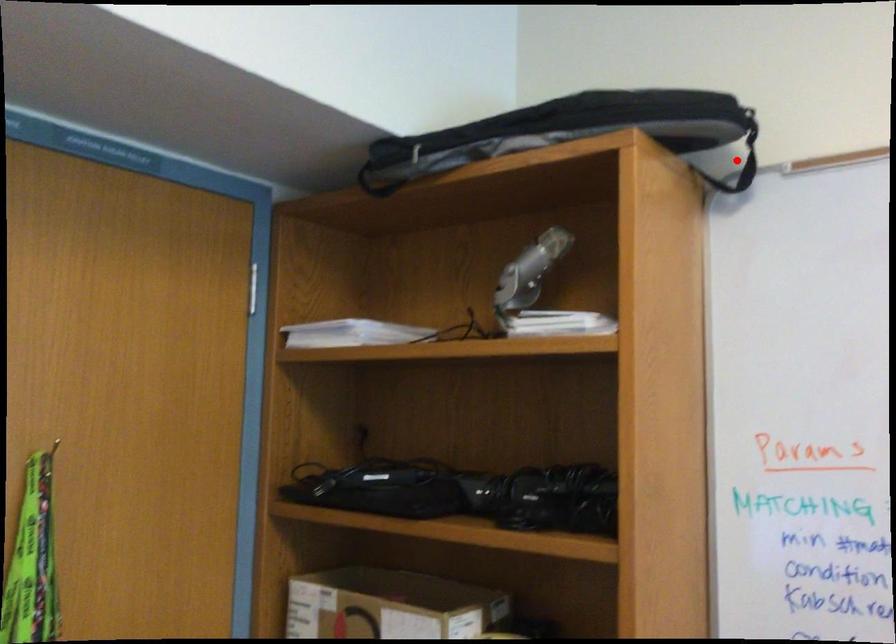
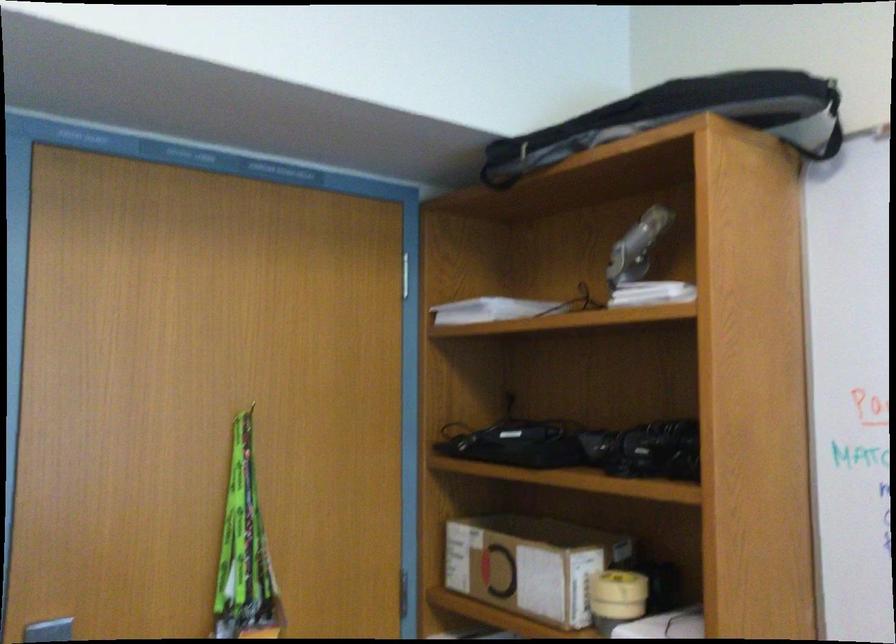
Find the pixel in the second image that matches the highlighted location in the first image.

(829, 129)